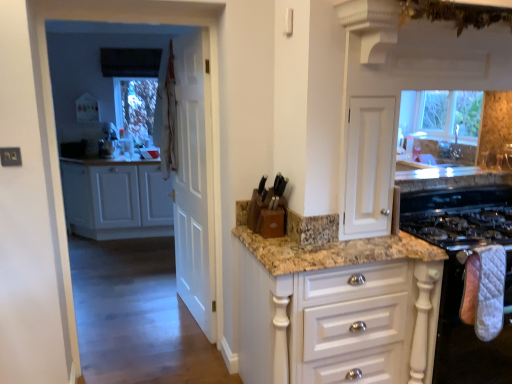
Question: Is white quilted oven mitt at lower right situated inside white fabric curtain at upper left or outside?

Choices:
 (A) outside
 (B) inside

Answer: (A)

Question: In terms of width, does white quilted oven mitt at lower right look wider or thinner when compared to white fabric curtain at upper left?

Choices:
 (A) thin
 (B) wide

Answer: (B)

Question: Which is farther from the white fabric curtain at upper left?

Choices:
 (A) wooden knife block at center, the 1th appliance positioned from the top
 (B) white wood cabinets at left, which ranks as the second cabinetry in front-to-back order
 (C) white glossy cabinet at center, which is counted as the first cabinetry, starting from the front
 (D) white quilted oven mitt at right, which is counted as the 1th appliance, starting from the right
 (E) white quilted oven mitt at lower right

Answer: (E)

Question: Considering the real-world distances, which object is farthest from the white glossy cabinet at center, the first cabinetry in the right-to-left sequence?

Choices:
 (A) white quilted oven mitt at lower right
 (B) white wooden door at center
 (C) white wood cabinets at left, which appears as the 2th cabinetry when viewed from the right
 (D) white fabric curtain at upper left
 (E) wooden knife block at center, the 1th appliance positioned from the top

Answer: (C)